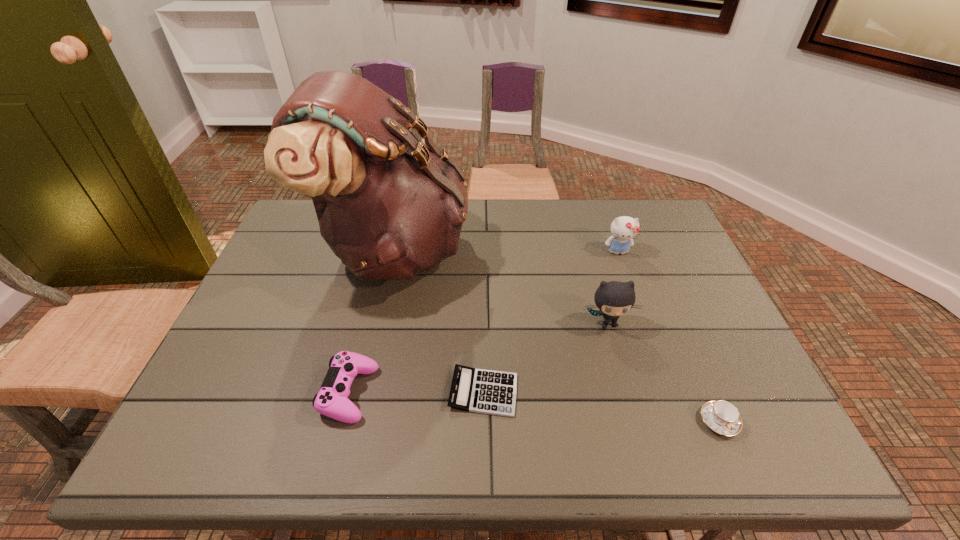
Identify the location of free space at the far edge of the desktop. The height and width of the screenshot is (540, 960). (560, 217).

Find the location of a particular element. This screenshot has width=960, height=540. vacant space at the near edge of the desktop is located at coordinates (489, 424).

Identify the location of vacant space at the left edge of the desktop. The image size is (960, 540). (305, 266).

Image resolution: width=960 pixels, height=540 pixels. I want to click on free space at the right edge, so click(720, 366).

The height and width of the screenshot is (540, 960). Identify the location of free space at the far left corner. (286, 242).

Where is `vacant space at the near left corner of the desktop`? The height and width of the screenshot is (540, 960). vacant space at the near left corner of the desktop is located at coordinates (x=180, y=438).

Where is `vacant area that lies between the tallest object and the calculator`? The height and width of the screenshot is (540, 960). vacant area that lies between the tallest object and the calculator is located at coordinates (439, 321).

I want to click on vacant area between the calculator and the fourth tallest object, so click(417, 393).

Identify the location of free spot between the tallest object and the third shortest object. (372, 321).

Locate an element on the screen. vacant region between the nearer kitten and the tallest object is located at coordinates (501, 287).